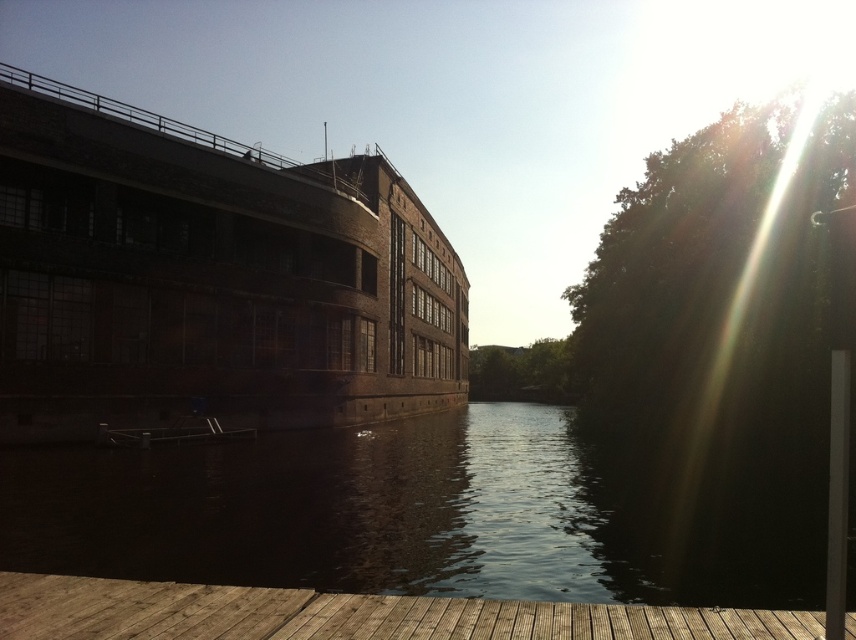
Does dark reflective water at center appear under wooden at lower left?

Correct, dark reflective water at center is located below wooden at lower left.

Which is above, dark reflective water at center or wooden at lower left?

wooden at lower left is above.

The width and height of the screenshot is (856, 640). I want to click on dark reflective water at center, so click(414, 515).

Identify the location of wooden at lower left. The width and height of the screenshot is (856, 640). (349, 614).

Which is behind, point (525, 612) or point (129, 440)?

Positioned behind is point (129, 440).

The image size is (856, 640). Identify the location of wooden at lower left. (349, 614).

Find the location of a particular element. This screenshot has height=640, width=856. wooden at lower left is located at coordinates (349, 614).

Locate an element on the screen. This screenshot has height=640, width=856. dark reflective water at center is located at coordinates (414, 515).

Who is more distant from viewer, (687, 602) or (177, 429)?

Point (177, 429)

Between point (33, 524) and point (205, 420), which one is positioned behind?

Positioned behind is point (205, 420).

Find the location of a particular element. dark reflective water at center is located at coordinates (414, 515).